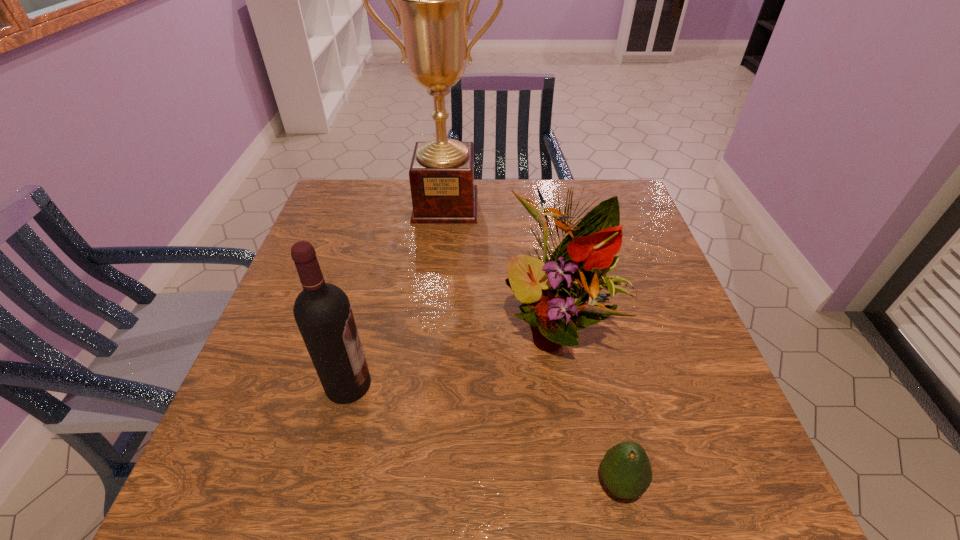
Locate an element on the screen. The width and height of the screenshot is (960, 540). free point between the wine bottle and the nearest object is located at coordinates (484, 434).

Image resolution: width=960 pixels, height=540 pixels. I want to click on vacant point located between the bouquet and the wine bottle, so (452, 356).

Locate an element on the screen. empty space between the farthest object and the wine bottle is located at coordinates (396, 295).

Identify the location of vacant space in between the bouquet and the wine bottle. Image resolution: width=960 pixels, height=540 pixels. (452, 356).

Where is `empty space that is in between the bouquet and the tallest object`? This screenshot has height=540, width=960. empty space that is in between the bouquet and the tallest object is located at coordinates (501, 266).

Locate an element on the screen. This screenshot has width=960, height=540. vacant space that's between the wine bottle and the bouquet is located at coordinates (452, 356).

Identify which object is the second nearest to the tallest object. Please provide its 2D coordinates. Your answer should be formatted as a tuple, i.e. [(x, y)], where the tuple contains the x and y coordinates of a point satisfying the conditions above.

[(322, 311)]

Select which object is the second closest to the shortest object. Please provide its 2D coordinates. Your answer should be formatted as a tuple, i.e. [(x, y)], where the tuple contains the x and y coordinates of a point satisfying the conditions above.

[(322, 311)]

Where is `free space that satisfies the following two spatial constraints: 1. on the label of the wine bottle; 2. on the back side of the nearest object`? This screenshot has width=960, height=540. free space that satisfies the following two spatial constraints: 1. on the label of the wine bottle; 2. on the back side of the nearest object is located at coordinates (323, 484).

The image size is (960, 540). Find the location of `free point that satisfies the following two spatial constraints: 1. on the plaque of the trophy cup; 2. on the label of the wine bottle`. free point that satisfies the following two spatial constraints: 1. on the plaque of the trophy cup; 2. on the label of the wine bottle is located at coordinates (427, 384).